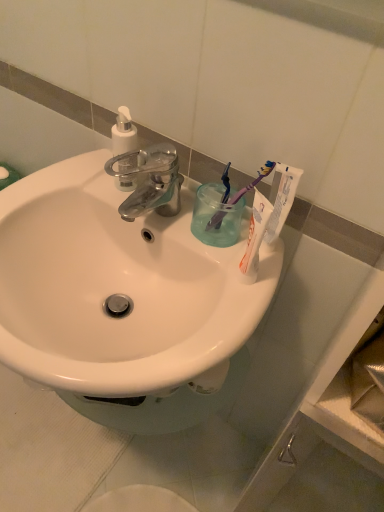
At what (x,y) coordinates should I click in order to perform the action: click on free space that is to the left of white plastic soap dispenser at upper left. Please return your answer as a coordinate pair (x, y). Looking at the image, I should click on (66, 179).